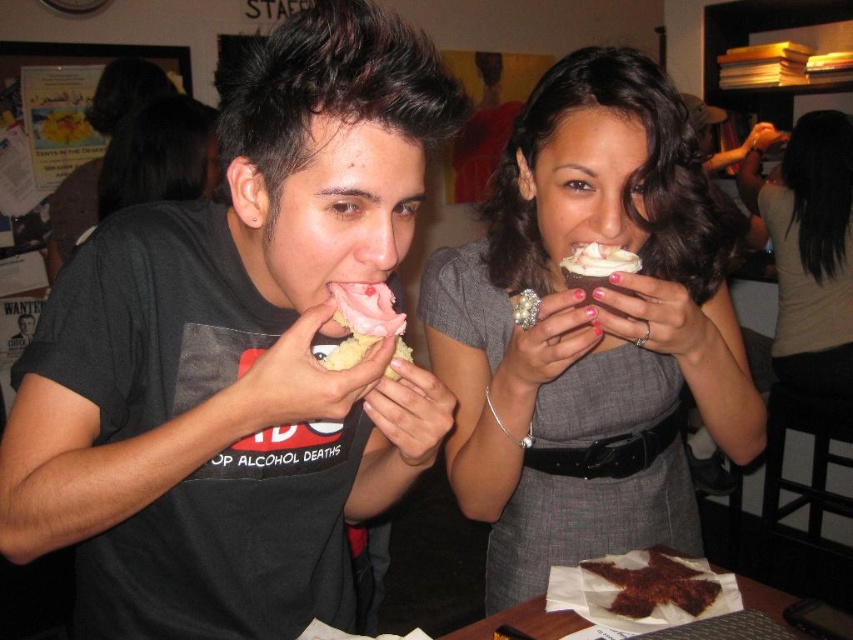
Is matte gray dress at center positioned in front of gray fabric dress at center?

Yes, matte gray dress at center is closer to the viewer.

From the picture: Does matte gray dress at center have a lesser width compared to gray fabric dress at center?

Incorrect, matte gray dress at center's width is not less than gray fabric dress at center's.

The image size is (853, 640). What are the coordinates of `matte gray dress at center` in the screenshot? It's located at (589, 330).

Is matte gray dress at center wider than white frosted cupcake at center?

Indeed, matte gray dress at center has a greater width compared to white frosted cupcake at center.

Is matte gray dress at center behind white frosted cupcake at center?

That is False.

Is point (637, 513) farther from viewer compared to point (587, 276)?

Yes, point (637, 513) is behind point (587, 276).

Identify the location of matte gray dress at center. The width and height of the screenshot is (853, 640). (589, 330).

Is matte black shirt at center thinner than white frosted cupcake at center?

No.

Which of these two, matte black shirt at center or white frosted cupcake at center, stands taller?

With more height is matte black shirt at center.

Image resolution: width=853 pixels, height=640 pixels. What do you see at coordinates (236, 356) in the screenshot?
I see `matte black shirt at center` at bounding box center [236, 356].

The width and height of the screenshot is (853, 640). In order to click on matte black shirt at center in this screenshot , I will do `click(236, 356)`.